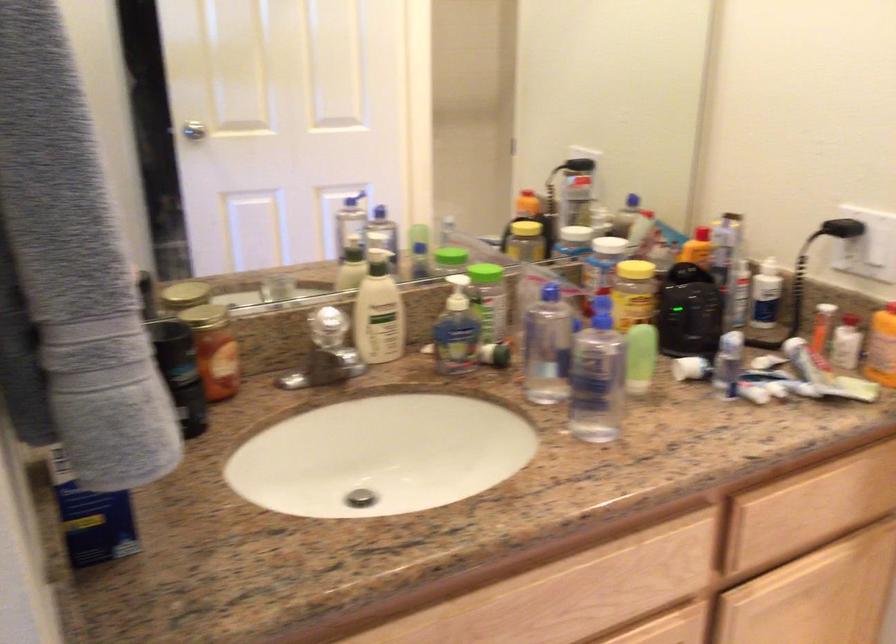
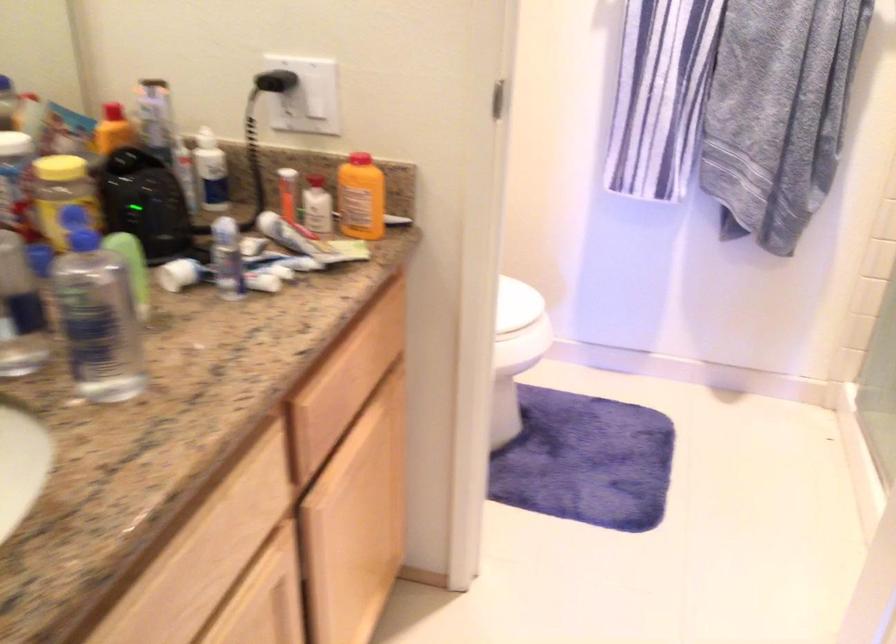
Question: The images are taken continuously from a first-person perspective. In which direction is your viewpoint rotating?

Choices:
 (A) Left
 (B) Right
 (C) Up
 (D) Down

Answer: (B)